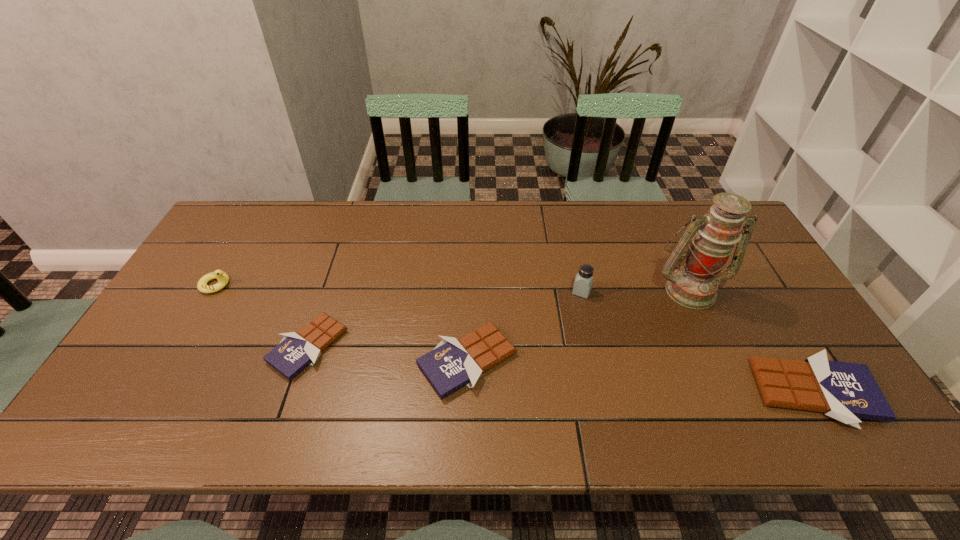
Please determine a free point for an extra chocolate_bar to ensure balance. Please provide its 2D coordinates. Your answer should be formatted as a tuple, i.e. [(x, y)], where the tuple contains the x and y coordinates of a point satisfying the conditions above.

[(636, 376)]